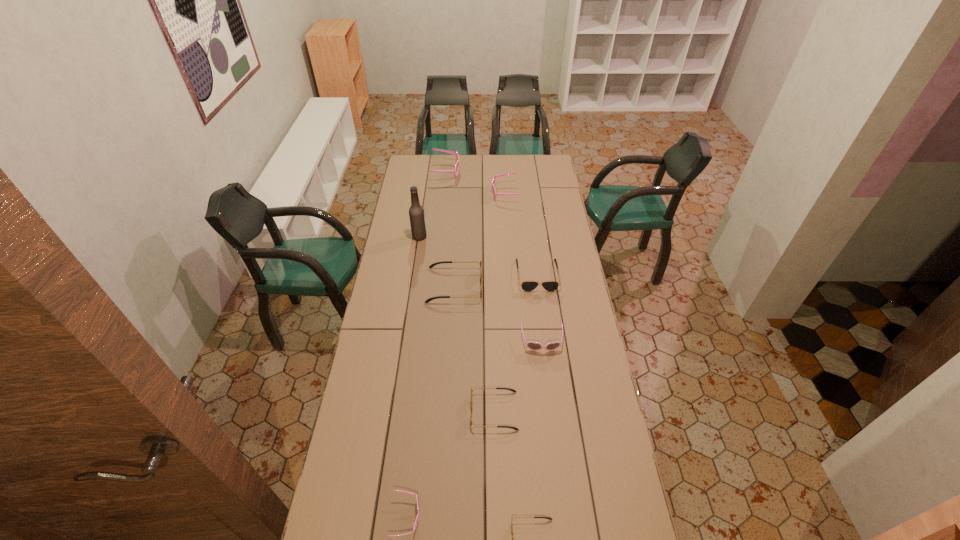
I want to click on the seventh farthest object, so click(x=512, y=390).

Where is `the third biggest black sunglasses`? This screenshot has height=540, width=960. the third biggest black sunglasses is located at coordinates (512, 390).

Where is `free location located on the label of the beer bottle`? The image size is (960, 540). free location located on the label of the beer bottle is located at coordinates (458, 237).

Locate an element on the screen. The width and height of the screenshot is (960, 540). vacant space situated 0.390m on the front-facing side of the biggest pink sunglasses is located at coordinates (524, 172).

In order to click on vacant space positioned on the front-facing side of the seventh nearest sunglasses in this screenshot , I will do `click(423, 193)`.

Where is `vacant position located on the front-facing side of the seventh nearest sunglasses`? The height and width of the screenshot is (540, 960). vacant position located on the front-facing side of the seventh nearest sunglasses is located at coordinates (436, 193).

Locate an element on the screen. vacant region located on the front-facing side of the seventh nearest sunglasses is located at coordinates (468, 193).

You are a GUI agent. You are given a task and a screenshot of the screen. Output one action in this format:
    pyautogui.click(x=<x>, y=<y>)
    Task: Click on the vacant region located 0.390m on the front-facing side of the biggest black sunglasses
    The image size is (960, 540).
    Given the screenshot: What is the action you would take?
    (567, 285)

The height and width of the screenshot is (540, 960). Identify the location of vacant space located 0.250m on the front-facing side of the second biggest black sunglasses. (545, 336).

Identify the location of vacant space located on the front-facing side of the third farthest pink sunglasses. The width and height of the screenshot is (960, 540). (546, 378).